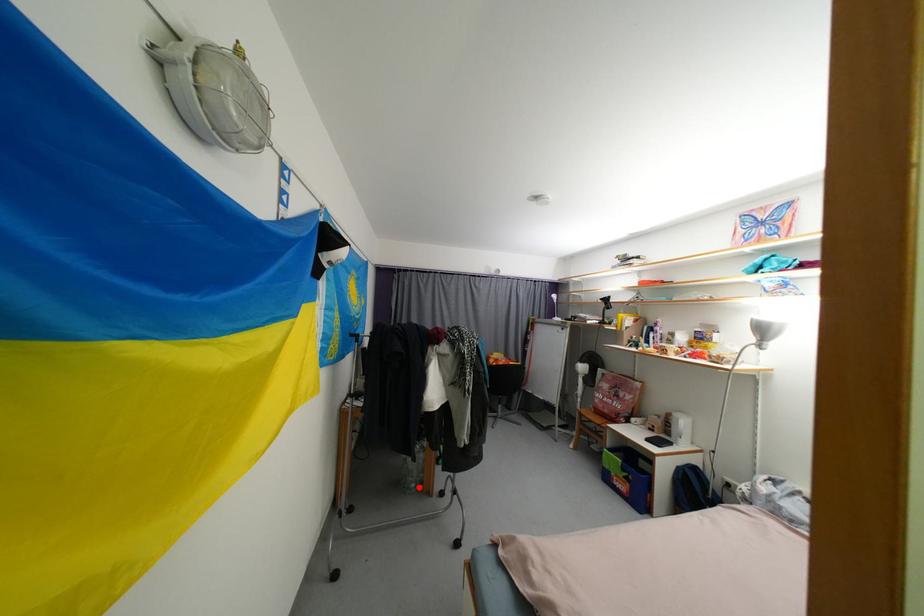
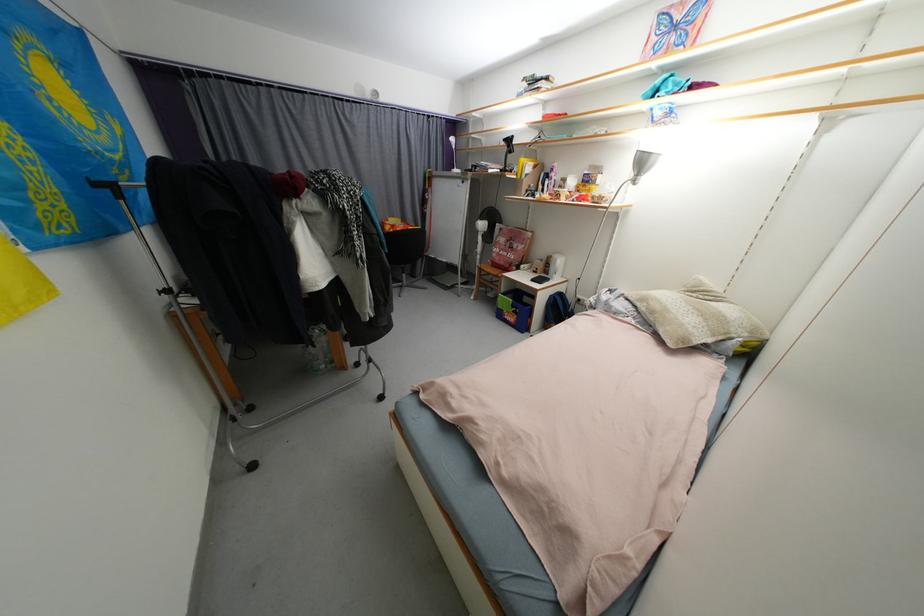
The point at the highlighted location is marked in the first image. Where is the corresponding point in the second image?

(329, 368)